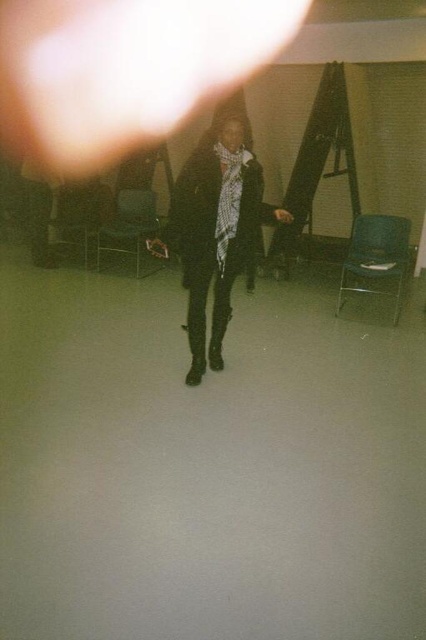
Question: Is metallic blue chair at right wider than metallic blue chair at center?

Choices:
 (A) no
 (B) yes

Answer: (B)

Question: Which is nearer to the metallic silver chair at center?

Choices:
 (A) black matte coat at center
 (B) metallic silver chair at left
 (C) metallic blue chair at right

Answer: (B)

Question: Which is farther from the metallic silver chair at center?

Choices:
 (A) metallic silver chair at left
 (B) metallic blue chair at center
 (C) black matte coat at center

Answer: (C)

Question: Among these points, which one is farthest from the camera?

Choices:
 (A) (74, 202)
 (B) (241, 163)
 (C) (377, 230)

Answer: (A)

Question: Does black matte coat at center have a smaller size compared to metallic silver chair at center?

Choices:
 (A) yes
 (B) no

Answer: (A)

Question: Is black matte coat at center further to camera compared to metallic blue chair at right?

Choices:
 (A) yes
 (B) no

Answer: (B)